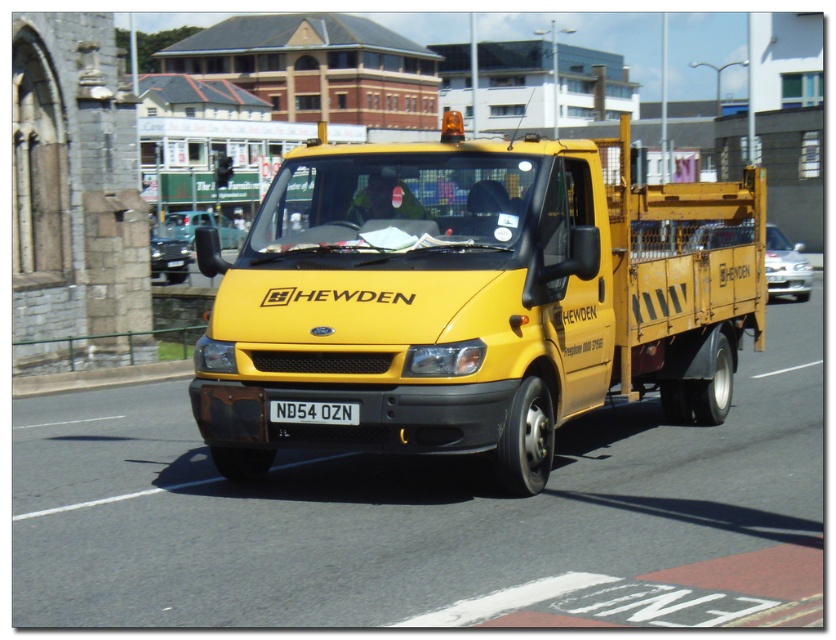
Question: Is yellow matte truck at center positioned at the back of white plastic license plate at center?

Choices:
 (A) no
 (B) yes

Answer: (A)

Question: Does yellow matte truck at center have a smaller size compared to white plastic license plate at center?

Choices:
 (A) yes
 (B) no

Answer: (B)

Question: Which point is closer to the camera?

Choices:
 (A) yellow matte truck at center
 (B) white plastic license plate at center

Answer: (A)

Question: Does yellow matte truck at center appear under white plastic license plate at center?

Choices:
 (A) yes
 (B) no

Answer: (B)